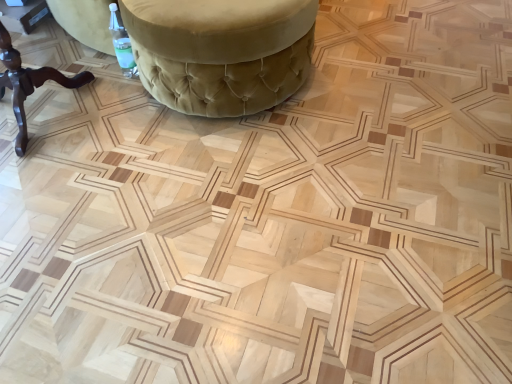
Where is `vacant area situated below brown wooden table at left, the 1th furniture in the left-to-right sequence (from a real-world perspective)`? vacant area situated below brown wooden table at left, the 1th furniture in the left-to-right sequence (from a real-world perspective) is located at coordinates (58, 109).